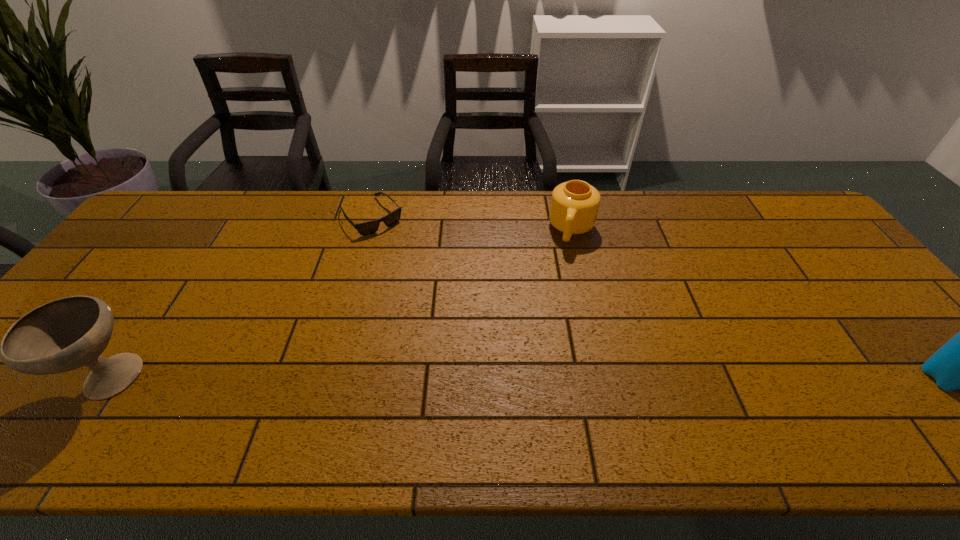
I want to click on object that stands as the second closest to the third shortest object, so click(574, 207).

The height and width of the screenshot is (540, 960). What are the coordinates of `object that can be found as the third closest to the leftmost object` in the screenshot? It's located at (959, 364).